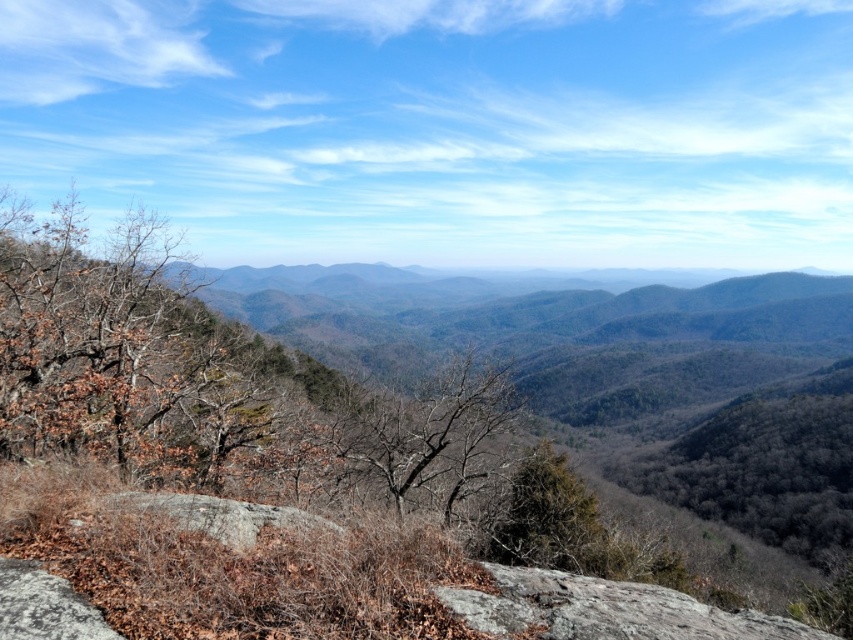
Is point (659, 464) farther from camera compared to point (120, 497)?

That is True.

Which is behind, point (647, 456) or point (132, 508)?

The point (647, 456) is behind.

At what (x,y) coordinates should I click in order to perform the action: click on dark green leafy tree at center-right. Please return your answer as a coordinate pair (x, y). The width and height of the screenshot is (853, 640). Looking at the image, I should click on (761, 468).

Who is more forward, (631, 476) or (569, 497)?

Point (569, 497) is more forward.

Which is below, dark green leafy tree at center-right or green leafy tree at center?

Positioned lower is dark green leafy tree at center-right.

Where is `dark green leafy tree at center-right`? dark green leafy tree at center-right is located at coordinates (761, 468).

Can you confirm if brown/dry bark tree at center is taller than gray rough rock at center?

Indeed, brown/dry bark tree at center has a greater height compared to gray rough rock at center.

Describe the element at coordinates (430, 433) in the screenshot. I see `brown/dry bark tree at center` at that location.

In order to click on brown/dry bark tree at center in this screenshot , I will do `click(430, 433)`.